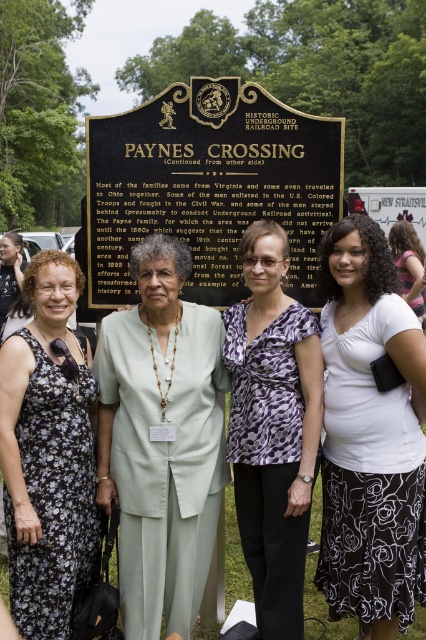
You are a fashion designer observing the women at the historical marker. You need to determine which clothing item has a larger surface area between the light green fabric at center and the purple printed blouse at center. Which one is it?

The light green fabric at center is larger in size than the purple printed blouse at center, so the light green fabric at center has a larger surface area.

You are a fashion designer observing the women at the historical marker. You notice the light green fabric at center and the purple printed blouse at center. Which clothing item is positioned lower on the body?

The light green fabric at center is positioned lower on the body because it is below the purple printed blouse at center.